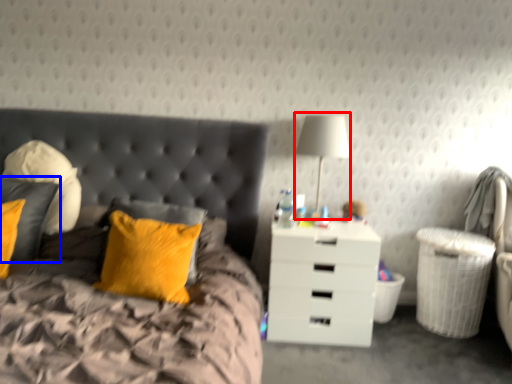
Question: Which object appears closest to the camera in this image, bedside lamp (highlighted by a red box) or pillow (highlighted by a blue box)?

Choices:
 (A) bedside lamp
 (B) pillow

Answer: (B)